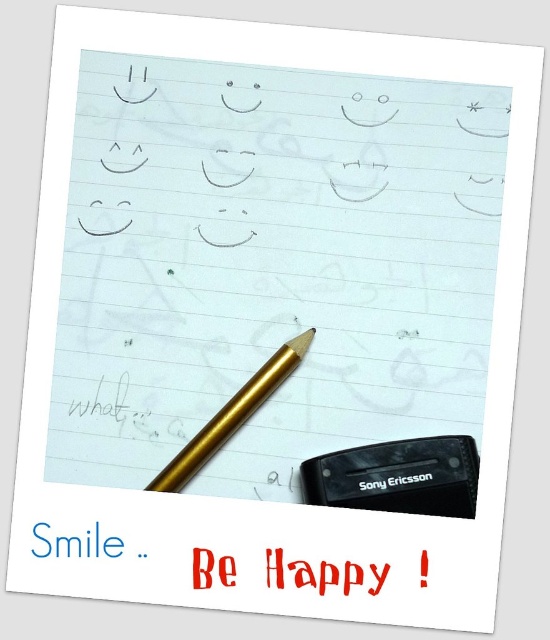
Does black plastic eraser at bottom right appear on the left side of gold metallic pencil at center?

In fact, black plastic eraser at bottom right is to the right of gold metallic pencil at center.

Can you confirm if black plastic eraser at bottom right is thinner than gold metallic pencil at center?

Incorrect, black plastic eraser at bottom right's width is not less than gold metallic pencil at center's.

Does point (393, 474) come closer to viewer compared to point (287, 371)?

Yes, point (393, 474) is closer to viewer.

This screenshot has height=640, width=550. Find the location of `black plastic eraser at bottom right`. black plastic eraser at bottom right is located at coordinates (398, 476).

Does point (383, 490) come closer to viewer compared to point (315, 580)?

No, it is behind (315, 580).

This screenshot has width=550, height=640. What do you see at coordinates (398, 476) in the screenshot? I see `black plastic eraser at bottom right` at bounding box center [398, 476].

Image resolution: width=550 pixels, height=640 pixels. Find the location of `black plastic eraser at bottom right`. black plastic eraser at bottom right is located at coordinates coord(398,476).

Is gold metallic pencil at center further to camera compared to red plastic text at center?

Yes, it is.

Is gold metallic pencil at center to the left of red plastic text at center from the viewer's perspective?

Indeed, gold metallic pencil at center is positioned on the left side of red plastic text at center.

Is point (195, 467) positioned in front of point (332, 579)?

No.

Find the location of `gold metallic pencil at center`. gold metallic pencil at center is located at coordinates (232, 416).